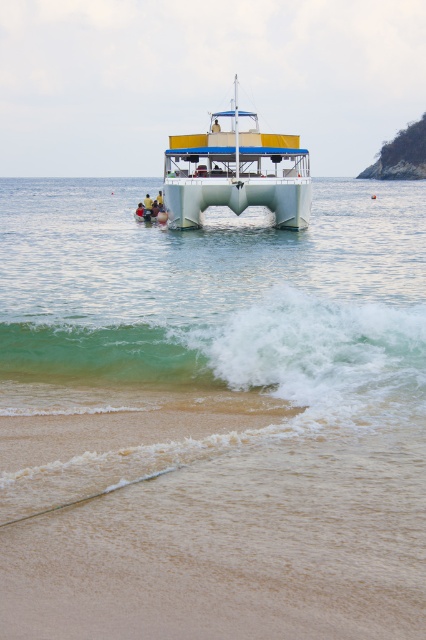
Is point (253, 481) behind point (40, 356)?

No, (253, 481) is in front of (40, 356).

Can you confirm if sandy beach at lower center is thinner than green translucent water at lower center?

In fact, sandy beach at lower center might be wider than green translucent water at lower center.

Does point (397, 593) come in front of point (385, 307)?

That is True.

The height and width of the screenshot is (640, 426). Find the location of `sandy beach at lower center`. sandy beach at lower center is located at coordinates (212, 522).

Is green translucent water at lower center bigger than white plastic boat at center?

No, green translucent water at lower center is not bigger than white plastic boat at center.

Between green translucent water at lower center and white plastic boat at center, which one is positioned higher?

white plastic boat at center

Identify the location of green translucent water at lower center. (226, 353).

From the picture: Can you confirm if sandy beach at lower center is positioned to the right of white plastic boat at center?

No, sandy beach at lower center is not to the right of white plastic boat at center.

Who is positioned more to the right, sandy beach at lower center or white plastic boat at center?

Positioned to the right is white plastic boat at center.

Identify the location of sandy beach at lower center. (212, 522).